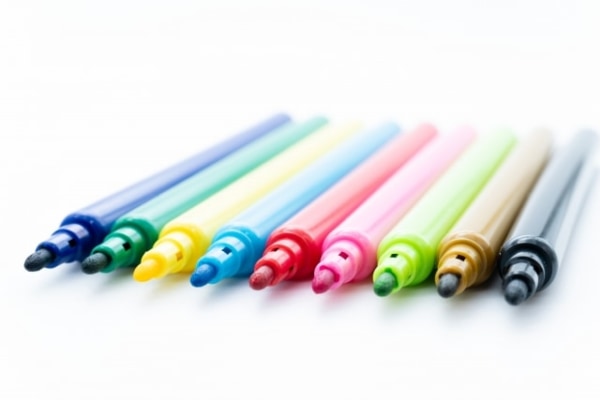
The image size is (600, 400). Identify the location of markers. (530, 272), (465, 271), (411, 271), (346, 254), (276, 254), (235, 254), (168, 254), (117, 254), (64, 244).